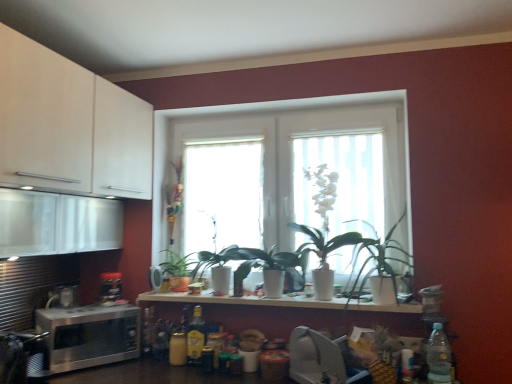
Question: Is translucent glass bottle at center, arranged as the first bottle when viewed from the back, further to the viewer compared to white glossy pot at center, which ranks as the first plant in left-to-right order?

Choices:
 (A) yes
 (B) no

Answer: (A)

Question: Can you confirm if translucent glass bottle at center, the 3th bottle from the front, is thinner than white glossy pot at center, which appears as the second plant when viewed from the right?

Choices:
 (A) yes
 (B) no

Answer: (A)

Question: From the image's perspective, is translucent glass bottle at center, positioned as the 1th bottle in left-to-right order, above white glossy pot at center, which ranks as the first plant in left-to-right order?

Choices:
 (A) no
 (B) yes

Answer: (A)

Question: From a real-world perspective, does translucent glass bottle at center, arranged as the first bottle when viewed from the back, sit lower than white glossy pot at center, which appears as the second plant when viewed from the right?

Choices:
 (A) no
 (B) yes

Answer: (B)

Question: Is translucent glass bottle at center, arranged as the first bottle when viewed from the back, facing towards white glossy pot at center, which appears as the second plant when viewed from the right?

Choices:
 (A) no
 (B) yes

Answer: (A)

Question: Is translucent glass bottle at center, acting as the 3th bottle starting from the right, surrounding white glossy pot at center, which ranks as the first plant in left-to-right order?

Choices:
 (A) yes
 (B) no

Answer: (B)

Question: Is satin silver microwave at lower left, the third appliance when ordered from right to left, positioned with its back to satin silver microwave at left, the 2th appliance positioned from the left?

Choices:
 (A) no
 (B) yes

Answer: (A)

Question: Would you say satin silver microwave at left, the 2th appliance positioned from the left, is part of satin silver microwave at lower left, which ranks as the second appliance in front-to-back order,'s contents?

Choices:
 (A) yes
 (B) no

Answer: (B)

Question: Would you say satin silver microwave at lower left, the third appliance when ordered from right to left, is outside satin silver microwave at left, acting as the second appliance starting from the right?

Choices:
 (A) yes
 (B) no

Answer: (A)

Question: Considering the relative sizes of satin silver microwave at lower left, which appears as the second appliance when viewed from the back, and satin silver microwave at left, acting as the 1th appliance starting from the back, in the image provided, is satin silver microwave at lower left, which appears as the second appliance when viewed from the back, taller than satin silver microwave at left, acting as the 1th appliance starting from the back,?

Choices:
 (A) no
 (B) yes

Answer: (B)

Question: Is satin silver microwave at lower left, the third appliance when ordered from right to left, placed right next to satin silver microwave at left, arranged as the third appliance when viewed from the front?

Choices:
 (A) yes
 (B) no

Answer: (B)

Question: From the image's perspective, does satin silver microwave at lower left, the first appliance viewed from the left, appear lower than satin silver microwave at left, the 2th appliance positioned from the left?

Choices:
 (A) no
 (B) yes

Answer: (B)

Question: Is satin silver microwave at left, acting as the 1th appliance starting from the back, next to satin silver microwave at lower left, the first appliance viewed from the left, and touching it?

Choices:
 (A) no
 (B) yes

Answer: (A)